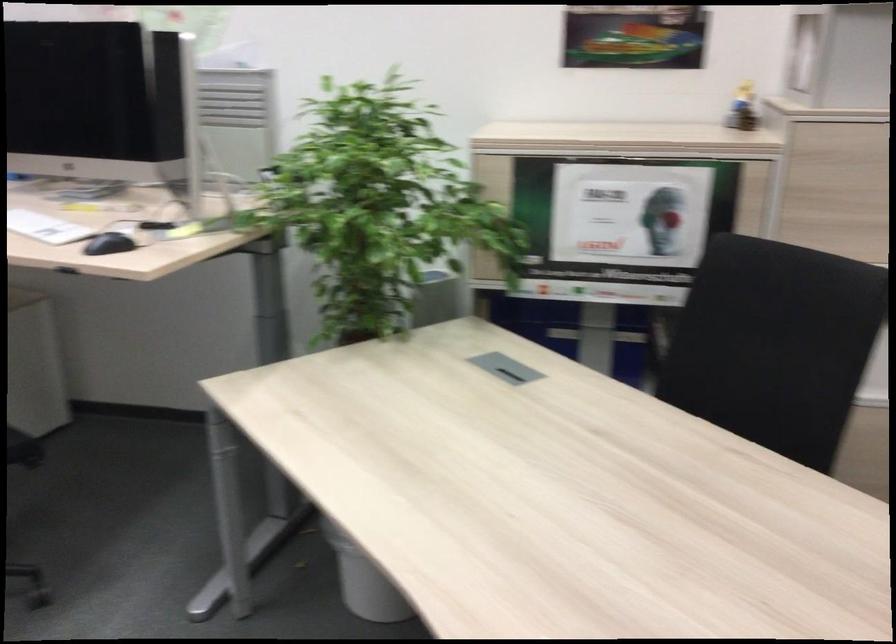
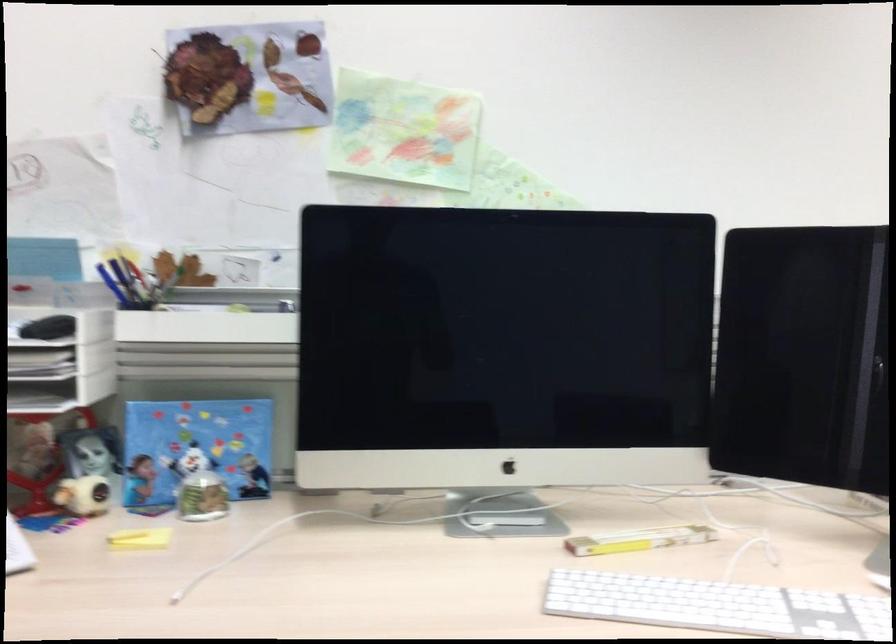
The point at (99, 187) is marked in the first image. Where is the corresponding point in the second image?

(449, 494)